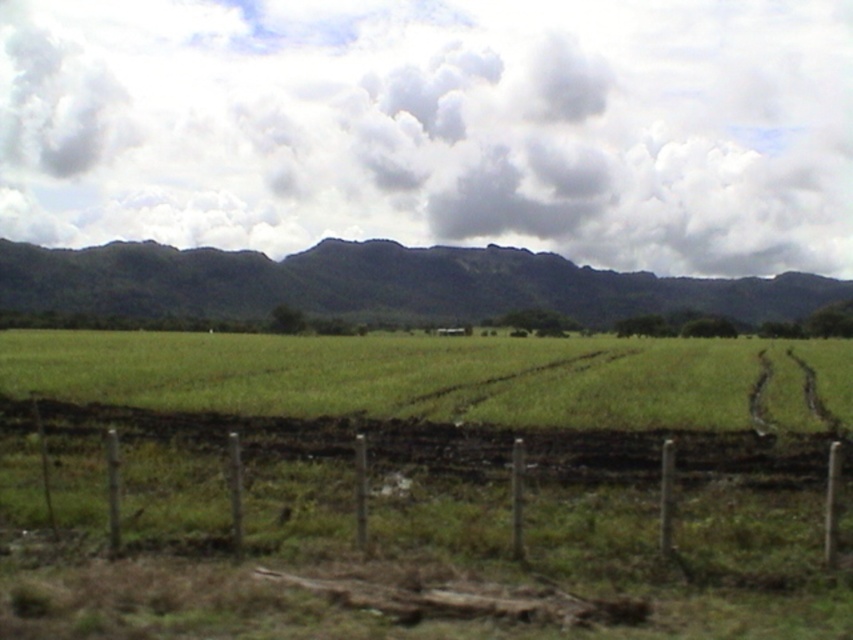
From the picture: You are standing in the middle of the image and looking forward. Which object will you see first between the brown wire fence at lower center and the green leafy mountain at center?

The brown wire fence at lower center will be seen first because it is closer to you than the green leafy mountain at center, which is further away.

You are standing in the middle of the green grass at center and want to reach the brown wire fence at lower center. Which direction should you move to get there?

The brown wire fence at lower center is positioned over green grass at center, so you should move forward towards the direction where the fence is located over the grass.

You are standing at the wire fence in the foreground of the rural landscape. You notice two points marked in the image. Which point, point 1 at coordinates (602, 515) or point 2 at coordinates (323, 264), is closer to you?

Point 1 at coordinates (602, 515) is closer to you than point 2 at coordinates (323, 264).